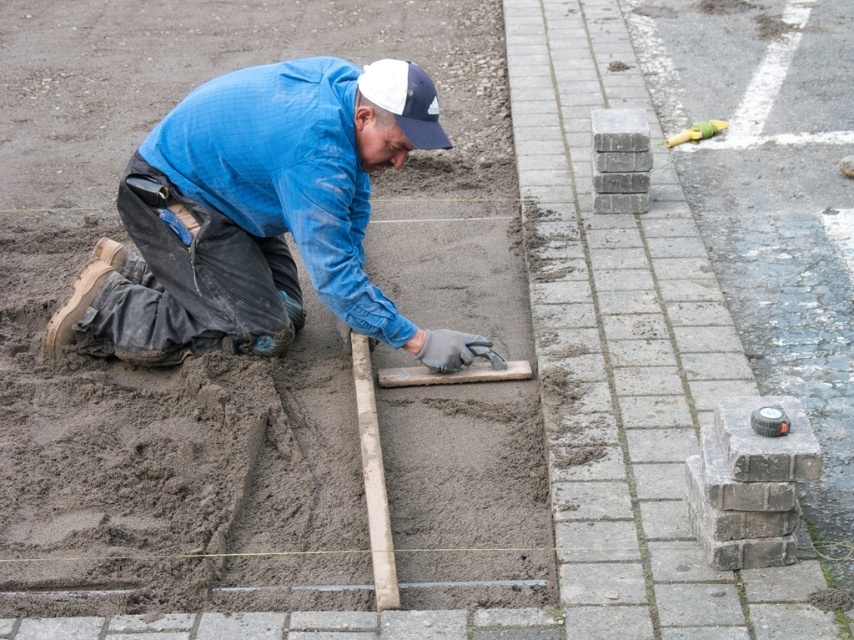
Question: Considering the relative positions of gray concrete bricks at center-right and white fabric baseball cap at upper center in the image provided, where is gray concrete bricks at center-right located with respect to white fabric baseball cap at upper center?

Choices:
 (A) left
 (B) right

Answer: (B)

Question: Is blue denim jacket at center below white fabric baseball cap at upper center?

Choices:
 (A) yes
 (B) no

Answer: (A)

Question: Which point appears closest to the camera in this image?

Choices:
 (A) (387, 84)
 (B) (219, 132)

Answer: (A)

Question: Which object is farther from the camera taking this photo?

Choices:
 (A) gray concrete bricks at center-right
 (B) blue denim jacket at center
 (C) white fabric baseball cap at upper center

Answer: (B)

Question: Which point appears closest to the camera in this image?

Choices:
 (A) (670, 628)
 (B) (431, 113)

Answer: (A)

Question: Does blue denim jacket at center appear under white fabric baseball cap at upper center?

Choices:
 (A) no
 (B) yes

Answer: (B)